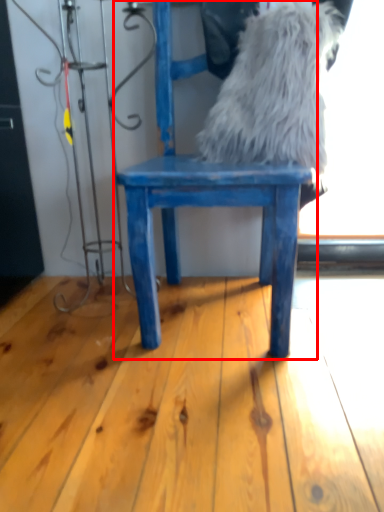
Question: Considering the relative positions of chair (annotated by the red box) and animal in the image provided, where is chair (annotated by the red box) located with respect to the staircase?

Choices:
 (A) left
 (B) right

Answer: (A)